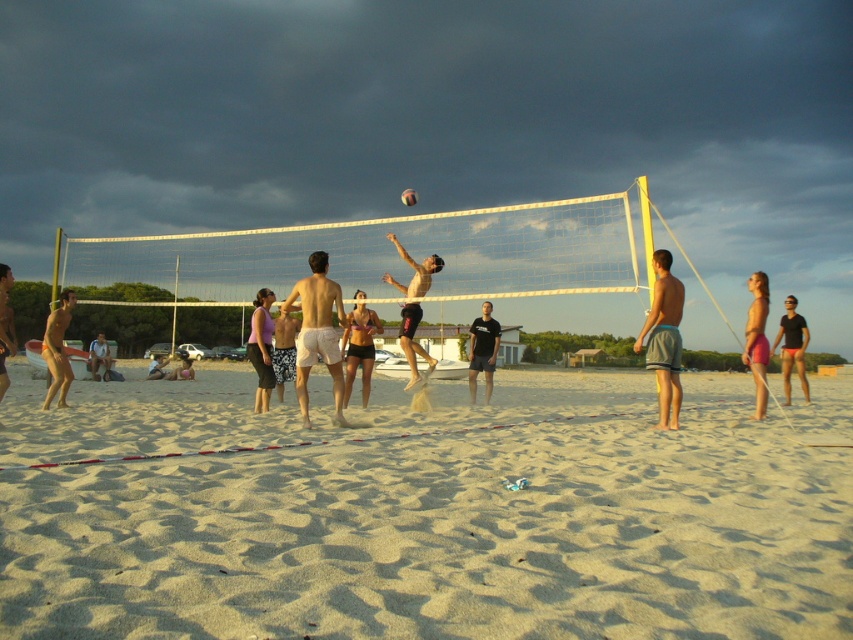
Question: Does matte black shorts at center come behind matte skin at lower left?

Choices:
 (A) yes
 (B) no

Answer: (B)

Question: Can you confirm if fine-grained sand at center is positioned to the right of matte black bikini top at center?

Choices:
 (A) yes
 (B) no

Answer: (A)

Question: Which object is the farthest from the matte white shorts at center?

Choices:
 (A) gray shorts at center
 (B) multicolored rubber volleyball at center

Answer: (A)

Question: Can you confirm if matte skin at lower left is bigger than white textured shorts at center?

Choices:
 (A) yes
 (B) no

Answer: (A)

Question: Which of these objects is positioned farthest from the white textured shorts at center?

Choices:
 (A) multicolored rubber volleyball at center
 (B) matte white shorts at center

Answer: (B)

Question: Which point is farther from the camera taking this photo?

Choices:
 (A) coord(165,378)
 (B) coord(256,369)
 (C) coord(410,189)
 (D) coord(283,358)

Answer: (A)